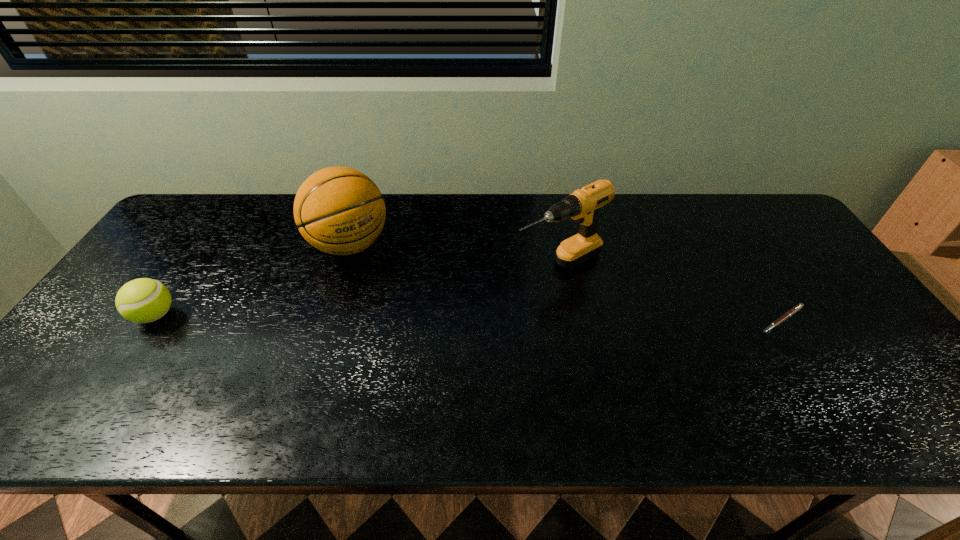
You are a GUI agent. You are given a task and a screenshot of the screen. Output one action in this format:
    pyautogui.click(x=<x>, y=<y>)
    Task: Click on the free space located on the surface of the second object from left to right near the brand logo
    This screenshot has height=540, width=960.
    Given the screenshot: What is the action you would take?
    pyautogui.click(x=418, y=338)

At what (x,y) coordinates should I click in order to perform the action: click on free space located 0.150m at the tip of the third object from left to right. Please return your answer as a coordinate pair (x, y). This screenshot has width=960, height=540. Looking at the image, I should click on (478, 303).

Identify the location of vacant space located 0.230m at the tip of the third object from left to right. (452, 316).

In order to click on free space located 0.220m at the tip of the third object from left to right in this screenshot , I will do `click(455, 315)`.

The width and height of the screenshot is (960, 540). Find the location of `object positioned at the far edge`. object positioned at the far edge is located at coordinates (338, 210).

I want to click on object that is at the left edge, so click(144, 300).

The width and height of the screenshot is (960, 540). Find the location of `object located in the right edge section of the desktop`. object located in the right edge section of the desktop is located at coordinates (792, 311).

In the image, there is a desktop. Where is `vacant space at the far edge`? vacant space at the far edge is located at coordinates (432, 220).

Find the location of a particular element. The width and height of the screenshot is (960, 540). free space at the near edge of the desktop is located at coordinates coord(432,364).

In the image, there is a desktop. Where is `vacant area at the left edge`? vacant area at the left edge is located at coordinates (137, 327).